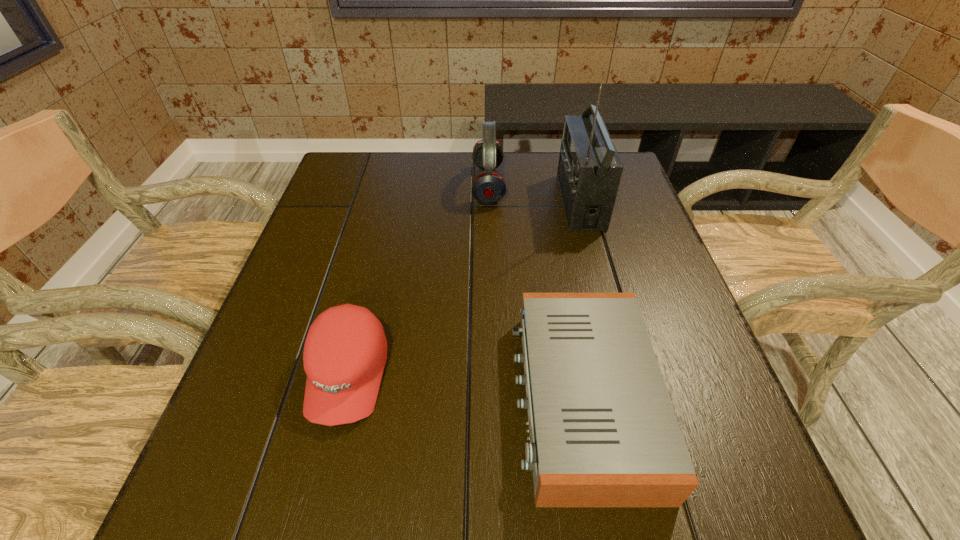
You are a GUI agent. You are given a task and a screenshot of the screen. Output one action in this format:
    pyautogui.click(x=<x>, y=<y>)
    Task: Click on the vacant space situated 0.240m on the ear cups of the earphone
    This screenshot has height=540, width=960.
    Given the screenshot: What is the action you would take?
    pyautogui.click(x=388, y=185)

Find the location of a particular element. The height and width of the screenshot is (540, 960). vacant space located 0.240m on the ear cups of the earphone is located at coordinates (388, 185).

Identify the location of free space located 0.260m on the ear cups of the earphone. (380, 185).

Find the location of a particular element. This screenshot has width=960, height=540. vacant region located on the front panel of the nearer radio receiver is located at coordinates (346, 400).

Image resolution: width=960 pixels, height=540 pixels. In order to click on vacant space situated on the front panel of the nearer radio receiver in this screenshot , I will do `click(346, 400)`.

Where is `vacant space situated on the front panel of the nearer radio receiver`? The image size is (960, 540). vacant space situated on the front panel of the nearer radio receiver is located at coordinates (334, 400).

This screenshot has height=540, width=960. Find the location of `radio receiver at the far edge`. radio receiver at the far edge is located at coordinates (x=589, y=171).

The width and height of the screenshot is (960, 540). I want to click on earphone at the far edge, so click(x=488, y=187).

The width and height of the screenshot is (960, 540). Identify the location of object at the near edge. (603, 432).

In order to click on object located at the left edge in this screenshot , I will do `click(345, 351)`.